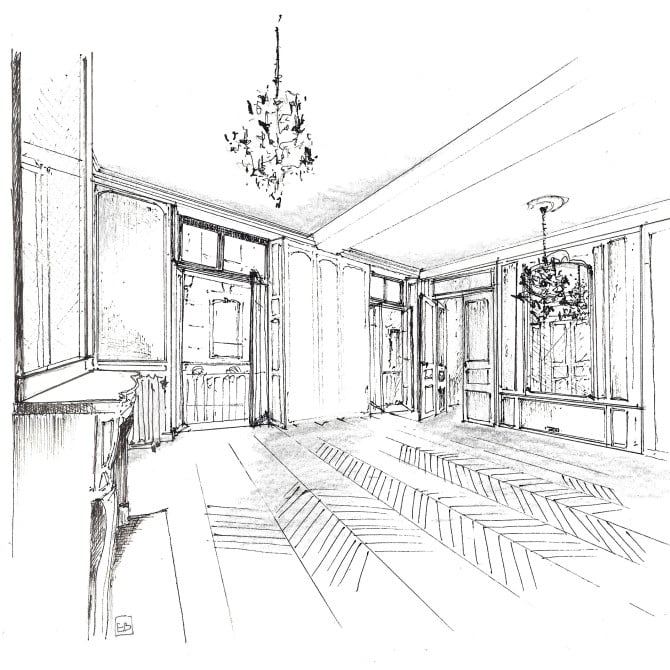
I want to click on back wall, so click(x=149, y=316).